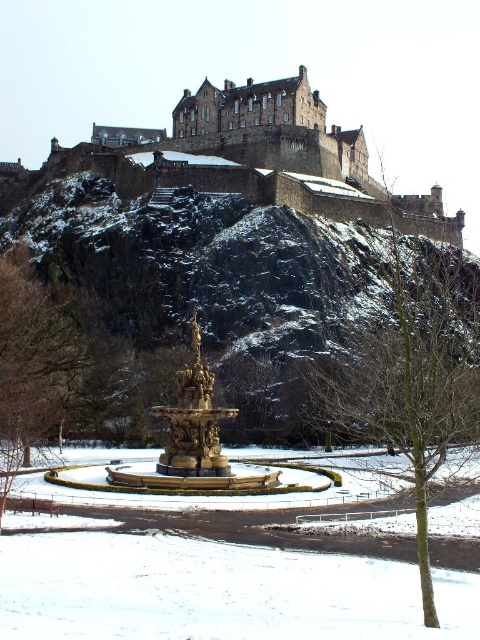
How far apart are snowy rock hill at upper center and bare wood tree at center?

snowy rock hill at upper center and bare wood tree at center are 18.87 meters apart from each other.

Does snowy rock hill at upper center have a greater width compared to bare wood tree at center?

Correct, the width of snowy rock hill at upper center exceeds that of bare wood tree at center.

Is point (159, 330) less distant than point (383, 332)?

Yes, point (159, 330) is in front of point (383, 332).

Identify the location of snowy rock hill at upper center. click(x=210, y=282).

Between snowy rock hill at upper center and brown textured tree at left, which one is positioned lower?

brown textured tree at left

Image resolution: width=480 pixels, height=640 pixels. In order to click on snowy rock hill at upper center in this screenshot , I will do `click(210, 282)`.

Find the location of a particular element. snowy rock hill at upper center is located at coordinates (210, 282).

Is white powdery snow at lower center smaller than brown textured tree at left?

Indeed, white powdery snow at lower center has a smaller size compared to brown textured tree at left.

The height and width of the screenshot is (640, 480). What are the coordinates of `white powdery snow at lower center` in the screenshot? It's located at (215, 592).